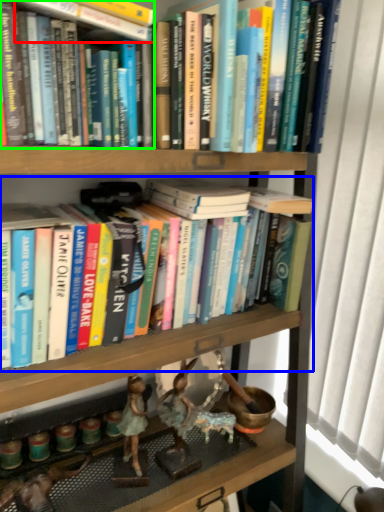
Question: Which object is the farthest from book (highlighted by a red box)? Choose among these: book (highlighted by a blue box) or book (highlighted by a green box).

Choices:
 (A) book
 (B) book

Answer: (A)